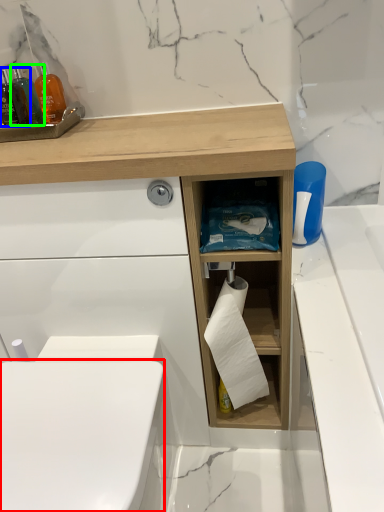
Question: Which is nearer to the toilet bowl (highlighted by a red box)? mouthwash (highlighted by a blue box) or mouthwash (highlighted by a green box).

Choices:
 (A) mouthwash
 (B) mouthwash

Answer: (A)